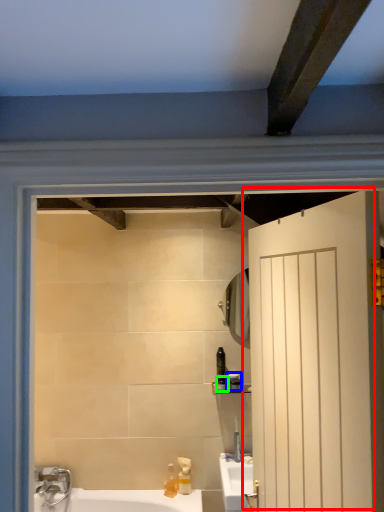
Question: Based on their relative distances, which object is nearer to door (highlighted by a red box)? Choose from toiletry (highlighted by a blue box) and toiletry (highlighted by a green box).

Choices:
 (A) toiletry
 (B) toiletry

Answer: (A)